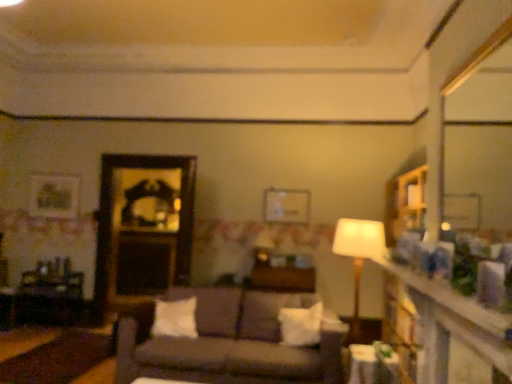
Question: From a real-world perspective, is white soft pillow at center, arranged as the 2th pillow when viewed from the left, physically located above or below smooth wooden mirror at upper right, which is counted as the second mirror, starting from the left?

Choices:
 (A) below
 (B) above

Answer: (A)

Question: Does point (301, 327) appear closer or farther from the camera than point (458, 192)?

Choices:
 (A) farther
 (B) closer

Answer: (B)

Question: Based on their relative distances, which object is nearer to the metallic silver picture frame at center?

Choices:
 (A) dark brown fabric couch at center
 (B) white glossy table at lower right, which appears as the third table when viewed from the back
 (C) wooden mirror at center, which is the second mirror in right-to-left order
 (D) white soft pillow at center, which is counted as the first pillow, starting from the right
 (E) smooth wooden mirror at upper right, which is counted as the second mirror, starting from the left

Answer: (C)

Question: Estimate the real-world distances between objects in this image. Which object is closer to the wooden table at left, which is counted as the first table, starting from the back?

Choices:
 (A) wooden mirror at center, positioned as the first mirror in left-to-right order
 (B) white fabric lampshade at center
 (C) wooden table at center, arranged as the second table when viewed from the back
 (D) smooth wooden mirror at upper right, positioned as the 1th mirror in right-to-left order
 (E) metallic silver picture frame at center

Answer: (A)